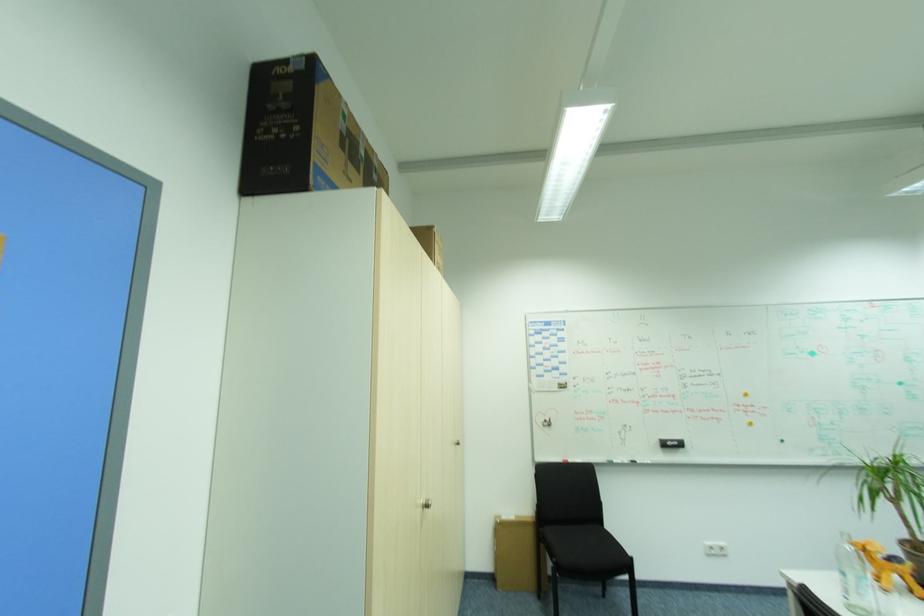
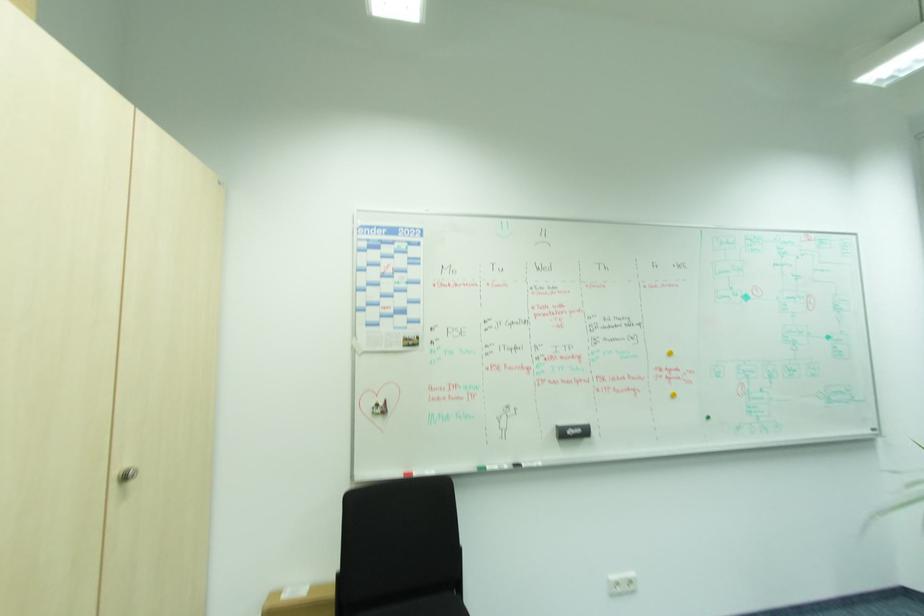
In the second image, find the point that corresponds to point 728,549 in the first image.

(635, 578)